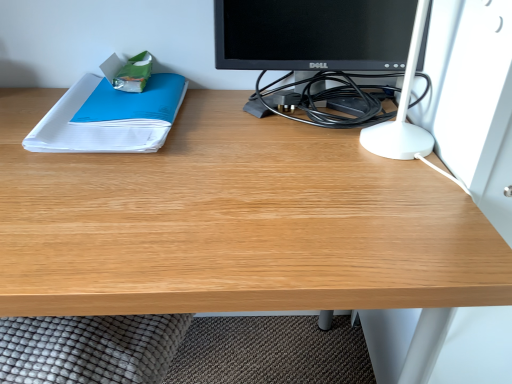
Identify the location of black glossy monitor at upper center. (331, 49).

The width and height of the screenshot is (512, 384). What do you see at coordinates (331, 49) in the screenshot?
I see `black glossy monitor at upper center` at bounding box center [331, 49].

What is the approximate height of black glossy monitor at upper center?

black glossy monitor at upper center is 22.24 centimeters tall.

What do you see at coordinates (109, 117) in the screenshot? I see `white paper at left` at bounding box center [109, 117].

Locate an element on the screen. This screenshot has width=512, height=384. white paper at left is located at coordinates (109, 117).

The height and width of the screenshot is (384, 512). I want to click on black glossy monitor at upper center, so click(331, 49).

Which is more to the right, white paper at left or black glossy monitor at upper center?

black glossy monitor at upper center.

Is white paper at left in front of or behind black glossy monitor at upper center in the image?

In the image, white paper at left appears behind black glossy monitor at upper center.

Considering the positions of points (164, 100) and (329, 19), is point (164, 100) farther from camera compared to point (329, 19)?

Yes, point (164, 100) is behind point (329, 19).

From the image's perspective, is white paper at left located above black glossy monitor at upper center?

Actually, white paper at left appears below black glossy monitor at upper center in the image.

From a real-world perspective, is white paper at left over black glossy monitor at upper center?

No, from a real-world perspective, white paper at left is not above black glossy monitor at upper center.

Is white paper at left wider or thinner than black glossy monitor at upper center?

white paper at left is wider than black glossy monitor at upper center.

In terms of height, does white paper at left look taller or shorter compared to black glossy monitor at upper center?

Clearly, white paper at left is shorter compared to black glossy monitor at upper center.

Considering the sizes of objects white paper at left and black glossy monitor at upper center in the image provided, who is smaller, white paper at left or black glossy monitor at upper center?

Smaller between the two is white paper at left.

Looking at this image, is black glossy monitor at upper center surrounded by white paper at left?

No, black glossy monitor at upper center is not a part of white paper at left.

Is white paper at left positioned far away from black glossy monitor at upper center?

No, white paper at left is in close proximity to black glossy monitor at upper center.

Could you tell me if white paper at left is facing black glossy monitor at upper center?

No, white paper at left is not aimed at black glossy monitor at upper center.

From the picture: Can you tell me how much white paper at left and black glossy monitor at upper center differ in facing direction?

The angle between the facing direction of white paper at left and the facing direction of black glossy monitor at upper center is 3.93 degrees.

Find the location of a particular element. Image resolution: width=512 pixels, height=384 pixels. paperback book behind the black glossy monitor at upper center is located at coordinates (109, 117).

Which is more to the right, black glossy monitor at upper center or white paper at left?

Positioned to the right is black glossy monitor at upper center.

Considering the positions of objects black glossy monitor at upper center and white paper at left in the image provided, who is in front, black glossy monitor at upper center or white paper at left?

black glossy monitor at upper center is closer to the camera.

Does point (227, 34) lie in front of point (142, 92)?

Yes.

From the image's perspective, between black glossy monitor at upper center and white paper at left, who is located below?

white paper at left.

From a real-world perspective, does black glossy monitor at upper center sit lower than white paper at left?

No, from a real-world perspective, black glossy monitor at upper center is not below white paper at left.

Does black glossy monitor at upper center have a greater width compared to white paper at left?

Incorrect, the width of black glossy monitor at upper center does not surpass that of white paper at left.

Between black glossy monitor at upper center and white paper at left, which one has more height?

Standing taller between the two is black glossy monitor at upper center.

Consider the image. Who is smaller, black glossy monitor at upper center or white paper at left?

With smaller size is white paper at left.

Is black glossy monitor at upper center situated inside white paper at left or outside?

black glossy monitor at upper center cannot be found inside white paper at left.

Is black glossy monitor at upper center not close to white paper at left?

That's not correct — black glossy monitor at upper center is a little close to white paper at left.

Does black glossy monitor at upper center turn towards white paper at left?

No, black glossy monitor at upper center is not oriented towards white paper at left.

What's the angular difference between black glossy monitor at upper center and white paper at left's facing directions?

black glossy monitor at upper center and white paper at left are facing 3.93 degrees away from each other.

Find the location of a particular element. This screenshot has width=512, height=384. paperback book behind the black glossy monitor at upper center is located at coordinates (109, 117).

Locate an element on the screen. Image resolution: width=512 pixels, height=384 pixels. paperback book that appears behind the black glossy monitor at upper center is located at coordinates (109, 117).

This screenshot has height=384, width=512. I want to click on desktop computer above the white paper at left (from a real-world perspective), so click(x=331, y=49).